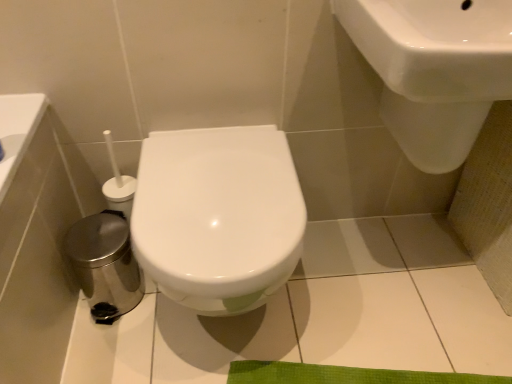
Locate an element on the screen. blank area beneath white glossy toilet at center (from a real-world perspective) is located at coordinates (234, 338).